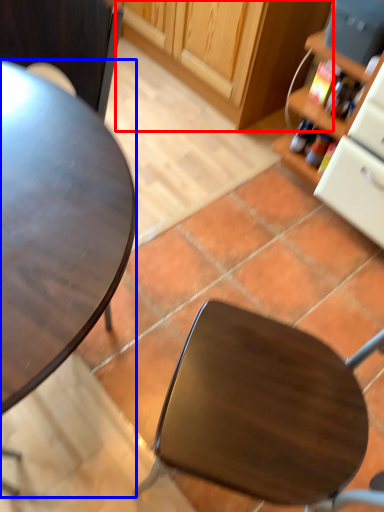
Question: Which object appears farthest to the camera in this image, cabinetry (highlighted by a red box) or desk (highlighted by a blue box)?

Choices:
 (A) cabinetry
 (B) desk

Answer: (A)